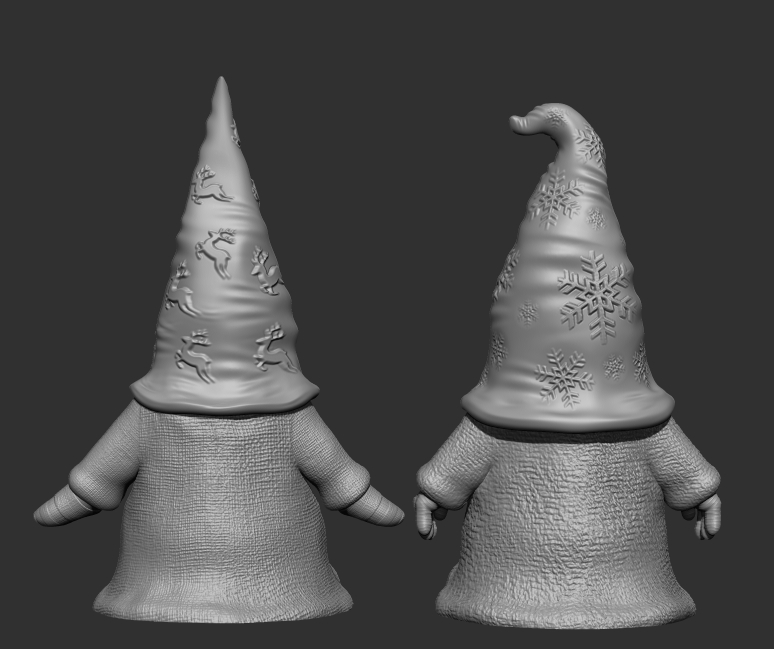
This screenshot has height=649, width=774. I want to click on clay gnomes, so click(x=233, y=544), click(x=224, y=250), click(x=615, y=287), click(x=546, y=476).